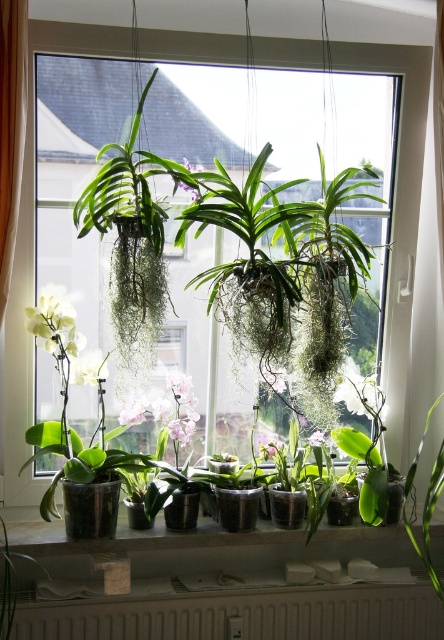
You are a plant enthusiast who wants to ensure all your plants get enough sunlight. You have a transparent glass window at center and a white matte orchid at left. Which object is wider?

The transparent glass window at center is wider than the white matte orchid at left according to the description.

You are a gardener who needs to water the plants on the matte concrete window sill at lower center. Your watering can holds 2 liters of water. Each plant requires 0.5 liters of water. How many plants can you water before needing to refill?

The question cannot be answered with the provided information because the number of plants on the matte concrete window sill at lower center is not specified in the scene description or object details.